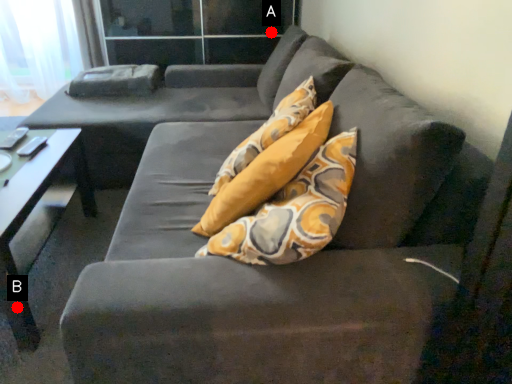
Question: Two points are circled on the image, labeled by A and B beside each circle. Among these points, which one is farthest from the camera?

Choices:
 (A) A is further
 (B) B is further

Answer: (A)